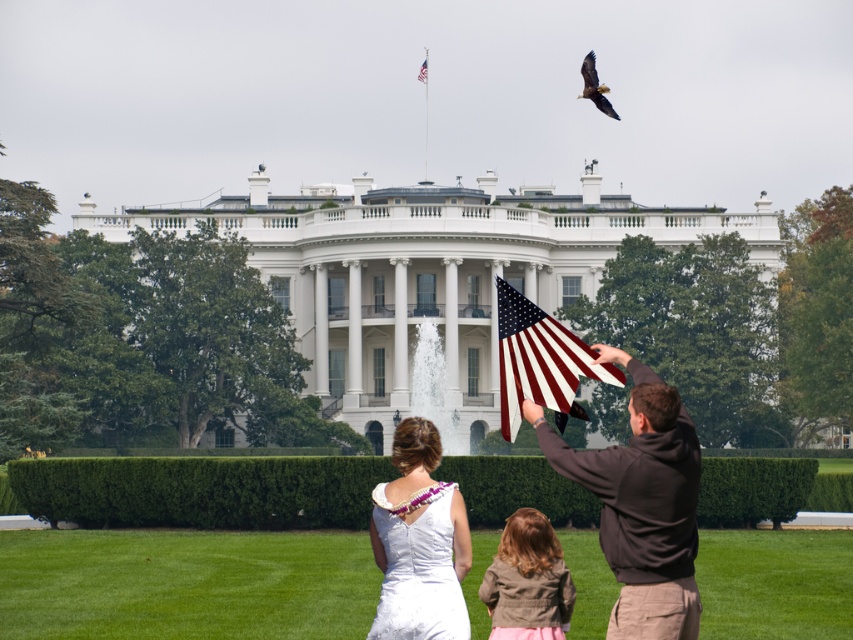
Which is above, green grass at lower center or american flag at center?

american flag at center

Is green grass at lower center bigger than american flag at center?

Yes, green grass at lower center is bigger than american flag at center.

Is point (223, 609) farther from viewer compared to point (422, 67)?

No.

Where is `green grass at lower center`? The height and width of the screenshot is (640, 853). green grass at lower center is located at coordinates (184, 582).

Which is more to the left, matte brown hoodie at center or brown feathered eagle at upper right?

matte brown hoodie at center is more to the left.

Does matte brown hoodie at center have a greater width compared to brown feathered eagle at upper right?

Yes.

What do you see at coordinates (641, 504) in the screenshot?
I see `matte brown hoodie at center` at bounding box center [641, 504].

This screenshot has width=853, height=640. I want to click on matte brown hoodie at center, so click(641, 504).

Can you confirm if white satin dress at center is bigger than american flag at center?

Indeed, white satin dress at center has a larger size compared to american flag at center.

How far apart are white satin dress at center and american flag at center?

white satin dress at center and american flag at center are 289.14 feet apart from each other.

Does point (392, 621) come closer to viewer compared to point (421, 67)?

Yes.

This screenshot has height=640, width=853. What are the coordinates of `white satin dress at center` in the screenshot? It's located at (419, 541).